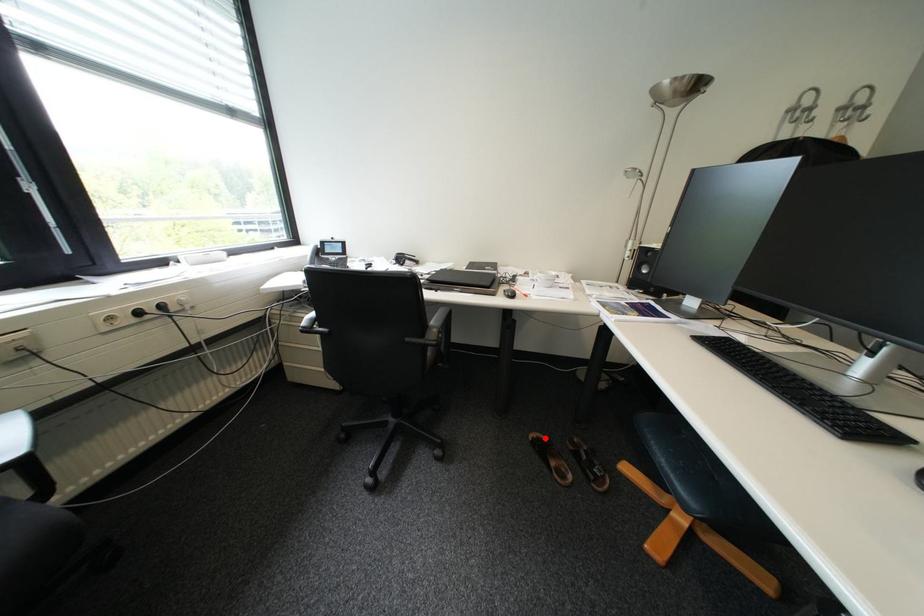
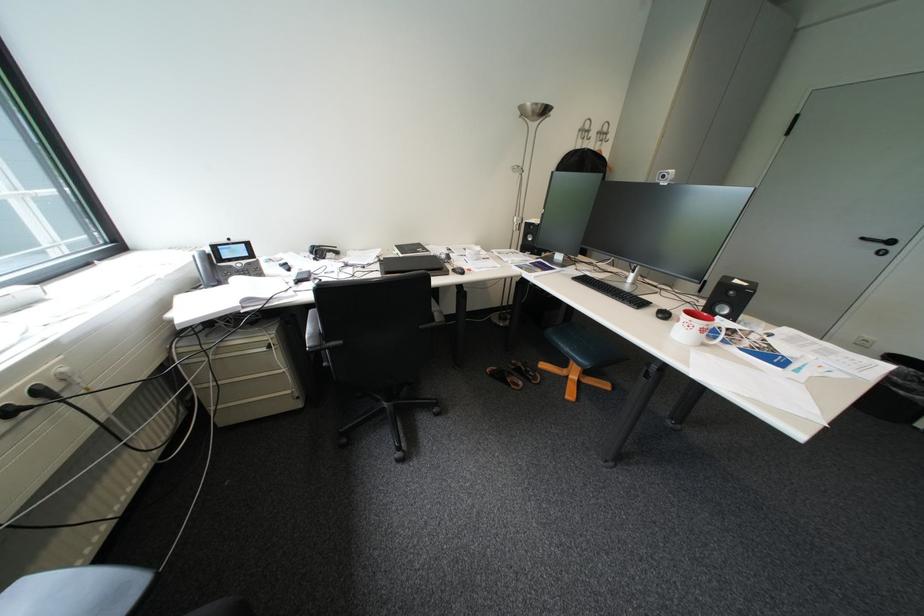
Where in the second image is the point corresponding to the highlighted location from the first image?

(502, 371)